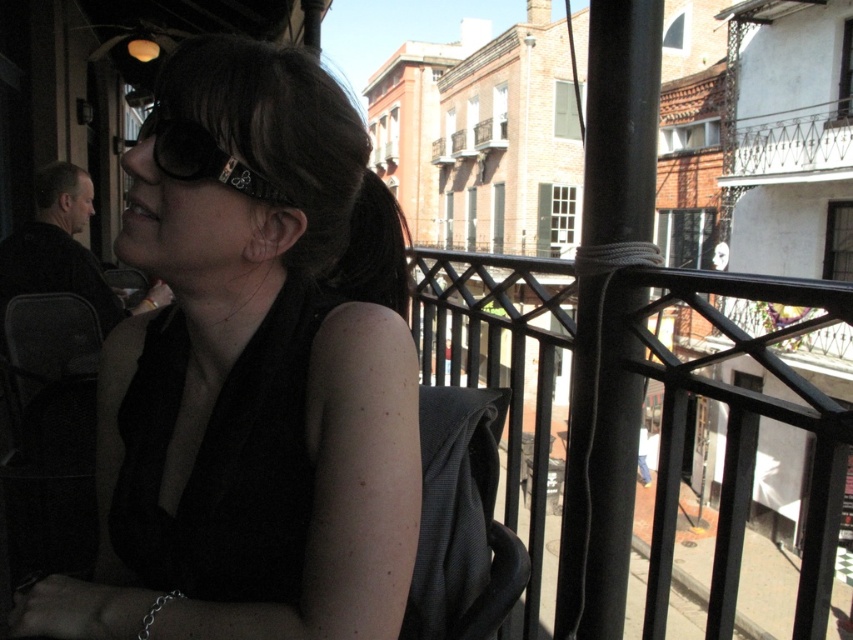
Does point (297, 284) come in front of point (433, 296)?

Yes, point (297, 284) is in front of point (433, 296).

Is matte black sunglasses at upper left thinner than black metal railing at center?

Correct, matte black sunglasses at upper left's width is less than black metal railing at center's.

Who is more distant from viewer, (x=36, y=628) or (x=827, y=280)?

The point (x=827, y=280) is behind.

Find the location of `matte black sunglasses at upper left`. matte black sunglasses at upper left is located at coordinates 252,372.

What do you see at coordinates (726, 444) in the screenshot? The height and width of the screenshot is (640, 853). I see `black metal railing at center` at bounding box center [726, 444].

Is point (468, 346) positioned after point (169, 163)?

Yes, it is.

Identify the location of black metal railing at center. The width and height of the screenshot is (853, 640). (726, 444).

Image resolution: width=853 pixels, height=640 pixels. What do you see at coordinates (252, 372) in the screenshot?
I see `matte black sunglasses at upper left` at bounding box center [252, 372].

Between point (328, 362) and point (160, 156), which one is positioned in front?

Point (328, 362) is more forward.

Locate an element on the screen. matte black sunglasses at upper left is located at coordinates (252, 372).

The height and width of the screenshot is (640, 853). I want to click on matte black sunglasses at upper left, so click(252, 372).